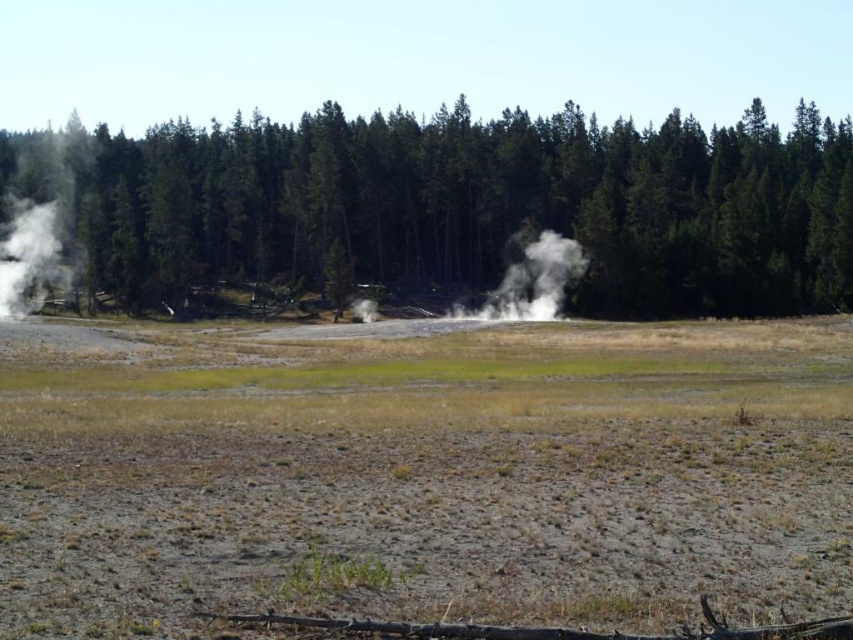
Question: Which object is farther from the camera taking this photo?

Choices:
 (A) dry grass at center
 (B) green matte trees at center

Answer: (B)

Question: Observing the image, what is the correct spatial positioning of green matte trees at center in reference to white vapor steam at left?

Choices:
 (A) right
 (B) left

Answer: (A)

Question: Among these points, which one is farthest from the camera?

Choices:
 (A) (90, 157)
 (B) (28, 225)

Answer: (A)

Question: Does dry grass at center appear on the right side of white vapor steam at left?

Choices:
 (A) no
 (B) yes

Answer: (B)

Question: Does dry grass at center appear over white vapor at center?

Choices:
 (A) no
 (B) yes

Answer: (A)

Question: Which of the following is the farthest from the observer?

Choices:
 (A) green matte trees at center
 (B) dry grass at center
 (C) white vapor steam at left

Answer: (A)